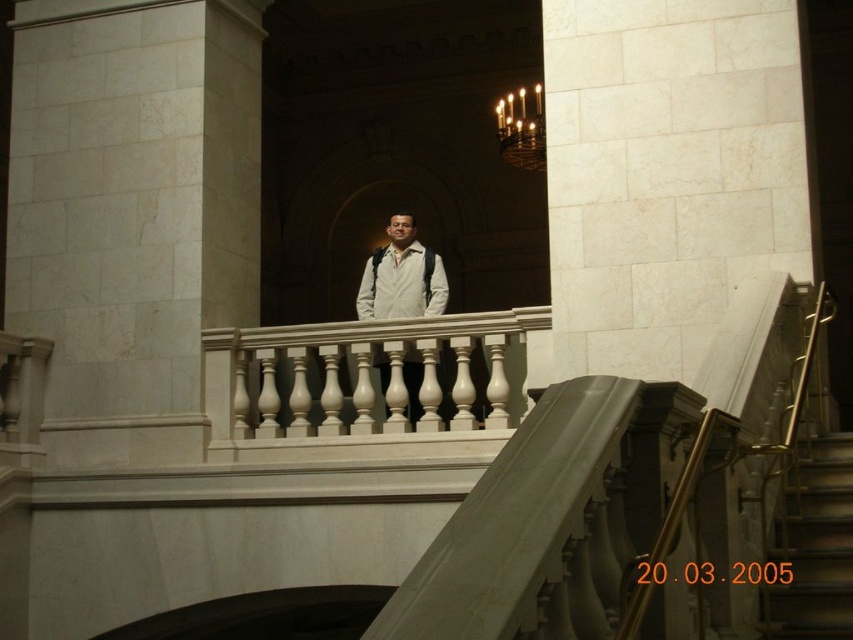
Is white marble balustrade at center closer to camera compared to metallic gold chandelier at upper center?

Yes.

Which of these two, white marble balustrade at center or metallic gold chandelier at upper center, stands taller?

metallic gold chandelier at upper center

The image size is (853, 640). What do you see at coordinates (363, 381) in the screenshot?
I see `white marble balustrade at center` at bounding box center [363, 381].

Find the location of `white marble balustrade at center`. white marble balustrade at center is located at coordinates (363, 381).

Who is more distant from viewer, (840,474) or (405,220)?

The point (405,220) is behind.

Is point (805, 502) in front of point (363, 308)?

Yes, point (805, 502) is closer to viewer.

Does point (793, 605) lie in front of point (389, 280)?

That is True.

Locate an element on the screen. This screenshot has height=640, width=853. dark brown wooden stairs at lower right is located at coordinates (814, 547).

Is dark brown wooden stairs at lower right further to the viewer compared to metallic gold chandelier at upper center?

No, dark brown wooden stairs at lower right is closer to the viewer.

Does point (834, 605) come behind point (500, 144)?

No, it is not.

This screenshot has width=853, height=640. I want to click on dark brown wooden stairs at lower right, so click(x=814, y=547).